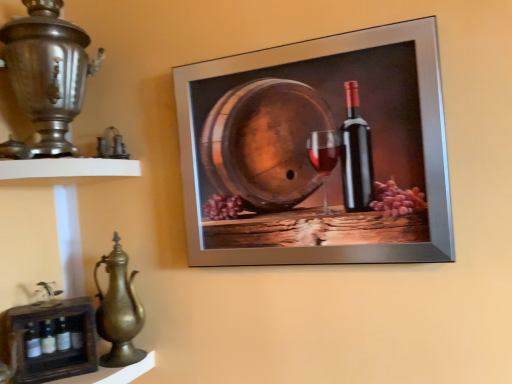
Question: In terms of height, does white matte shelf at left, the second shelf positioned from the bottom, look taller or shorter compared to metallic silver frame at upper center?

Choices:
 (A) tall
 (B) short

Answer: (B)

Question: Considering the relative positions of white matte shelf at left, the second shelf positioned from the bottom, and metallic silver frame at upper center in the image provided, is white matte shelf at left, the second shelf positioned from the bottom, to the left or to the right of metallic silver frame at upper center?

Choices:
 (A) left
 (B) right

Answer: (A)

Question: Which object is the farthest from the wooden crate at lower left, arranged as the second shelf when viewed from the top?

Choices:
 (A) white matte shelf at left, the second shelf positioned from the bottom
 (B) polished silver samovar at left
 (C) polished brass jug at lower left
 (D) metallic silver frame at upper center

Answer: (D)

Question: Which object is the closest to the white matte shelf at left, the second shelf positioned from the bottom?

Choices:
 (A) metallic silver frame at upper center
 (B) polished silver samovar at left
 (C) polished brass jug at lower left
 (D) wooden crate at lower left, which appears as the 1th shelf when ordered from the bottom

Answer: (B)